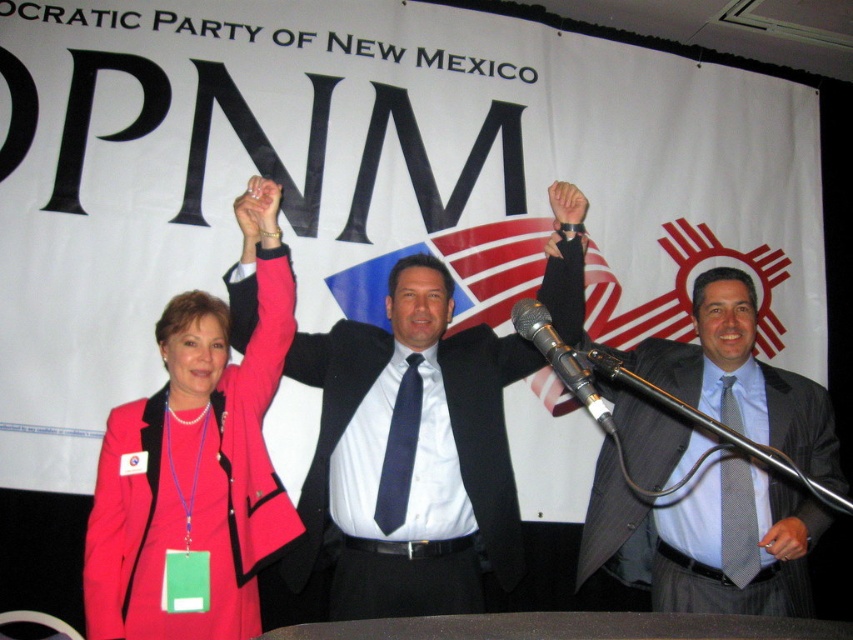
You are a photographer at the event and need to capture a photo where both the matte black suit at center and the metallic silver microphone at center are clearly visible. Given their height difference, which object will appear larger in the photo?

The matte black suit at center is taller than the metallic silver microphone at center, so it will appear larger in the photo.